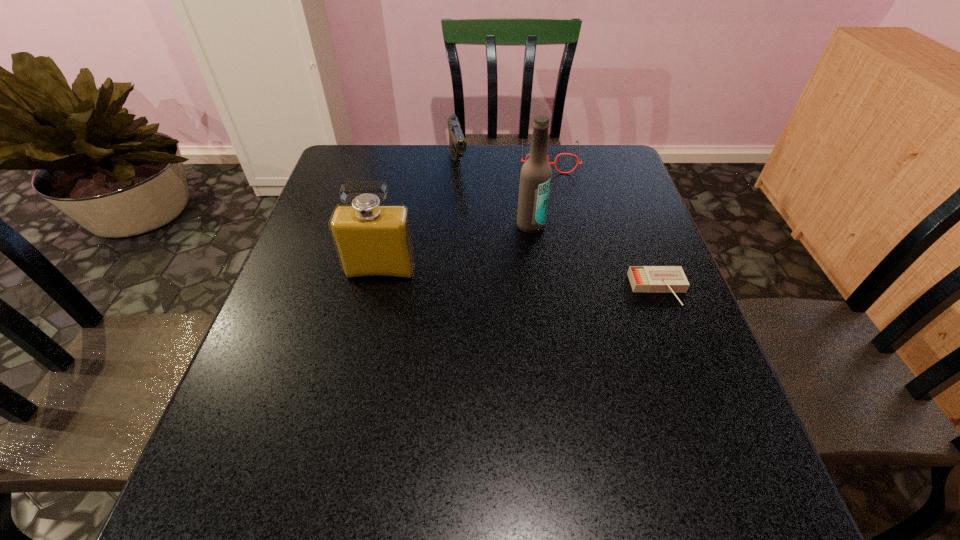
Where is `free space between the fourth shortest object and the rightmost object`? The width and height of the screenshot is (960, 540). free space between the fourth shortest object and the rightmost object is located at coordinates (519, 280).

Find the location of `free space between the matchbox and the leftmost object`. free space between the matchbox and the leftmost object is located at coordinates (519, 280).

Identify the location of free point between the fourth tallest object and the fourth object from right to left. (504, 161).

This screenshot has width=960, height=540. In order to click on vacant space in between the beer bottle and the matchbox in this screenshot , I will do `click(594, 257)`.

You are a GUI agent. You are given a task and a screenshot of the screen. Output one action in this format:
    pyautogui.click(x=<x>, y=<y>)
    Task: Click on the vacant space in between the beer bottle and the leftmost object
    This screenshot has height=540, width=960.
    Given the screenshot: What is the action you would take?
    pyautogui.click(x=456, y=248)

Locate an element on the screen. The image size is (960, 540). free spot between the beer bottle and the matchbox is located at coordinates (594, 257).

Locate an element on the screen. The image size is (960, 540). vacant space that is in between the leftmost object and the rightmost object is located at coordinates (519, 280).

Where is `empty location between the pistol and the shortest object`? empty location between the pistol and the shortest object is located at coordinates (558, 227).

Locate an element on the screen. Image resolution: width=960 pixels, height=540 pixels. blank region between the second shortest object and the leftmost object is located at coordinates (466, 214).

Find the location of a particular element. The image size is (960, 540). vacant area between the second tallest object and the beer bottle is located at coordinates (456, 248).